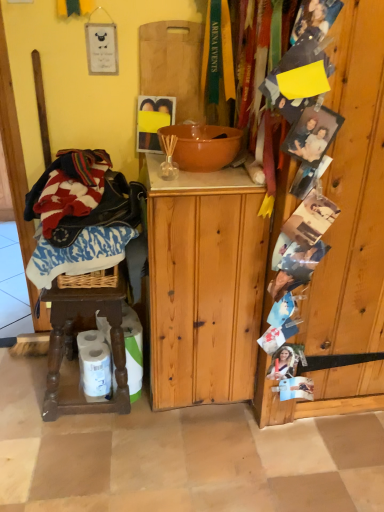
Measure the distance between brown wooden stool at lower left and camera.

The distance of brown wooden stool at lower left from camera is 1.32 meters.

Identify the location of white matte toilet paper at lower left, which is the first toilet paper in left-to-right order. The height and width of the screenshot is (512, 384). (95, 365).

Find the location of a particular element. The height and width of the screenshot is (512, 384). wooden cutting board at upper center is located at coordinates (172, 63).

Identify the location of orange ceramic bowl at center. (203, 146).

Does wooden photo display at right lie behind natural wood cabinet at center?

No, wooden photo display at right is closer to the viewer.

From a real-world perspective, is wooden photo display at right positioned over natural wood cabinet at center based on gravity?

Yes, from a real-world perspective, wooden photo display at right is above natural wood cabinet at center.

Is wooden photo display at right not near natural wood cabinet at center?

No, wooden photo display at right is not far away from natural wood cabinet at center.

Are natural wood cabinet at center and white matte toilet paper at lower left, which is the first toilet paper in left-to-right order, located far from each other?

They are positioned close to each other.

Does natural wood cabinet at center have a greater width compared to white matte toilet paper at lower left, positioned as the 2th toilet paper in right-to-left order?

Indeed, natural wood cabinet at center has a greater width compared to white matte toilet paper at lower left, positioned as the 2th toilet paper in right-to-left order.

Between point (172, 280) and point (102, 395), which one is positioned in front?

Point (172, 280)

Between natural wood cabinet at center and white matte toilet paper at lower left, positioned as the 2th toilet paper in right-to-left order, which one has smaller size?

With smaller size is white matte toilet paper at lower left, positioned as the 2th toilet paper in right-to-left order.

Is brown wooden stool at lower left aimed at natural wood cabinet at center?

No, brown wooden stool at lower left is not aimed at natural wood cabinet at center.

From the image's perspective, is brown wooden stool at lower left over natural wood cabinet at center?

No.

Looking at this image, which is closer to the camera, (60,301) or (258,234)?

Point (258,234)

From a real-world perspective, relative to natural wood cabinet at center, is brown wooden stool at lower left vertically above or below?

Clearly, from a real-world perspective, brown wooden stool at lower left is below natural wood cabinet at center.

Which of these two, orange ceramic bowl at center or wooden cutting board at upper center, stands shorter?

Standing shorter between the two is orange ceramic bowl at center.

Would you say orange ceramic bowl at center is a long distance from wooden cutting board at upper center?

No.

From a real-world perspective, is orange ceramic bowl at center below wooden cutting board at upper center?

Correct, in the physical world, orange ceramic bowl at center is lower than wooden cutting board at upper center.

Is orange ceramic bowl at center thinner than wooden cutting board at upper center?

No, orange ceramic bowl at center is not thinner than wooden cutting board at upper center.

Looking at this image, is natural wood cabinet at center thinner than wooden cutting board at upper center?

Incorrect, the width of natural wood cabinet at center is not less than that of wooden cutting board at upper center.

Image resolution: width=384 pixels, height=512 pixels. Identify the location of cabinetry on the right of the wooden cutting board at upper center. (204, 285).

Is natural wood cabinet at center positioned behind wooden cutting board at upper center?

No, the depth of natural wood cabinet at center is less than that of wooden cutting board at upper center.

How many degrees apart are the facing directions of natural wood cabinet at center and wooden cutting board at upper center?

4.28 degrees.

Considering the relative sizes of wooden cutting board at upper center and orange ceramic bowl at center in the image provided, is wooden cutting board at upper center bigger than orange ceramic bowl at center?

No, wooden cutting board at upper center is not bigger than orange ceramic bowl at center.

I want to click on cutting board behind the orange ceramic bowl at center, so click(x=172, y=63).

From the image's perspective, is wooden cutting board at upper center above or below orange ceramic bowl at center?

Clearly, from the image's perspective, wooden cutting board at upper center is above orange ceramic bowl at center.

This screenshot has height=512, width=384. In order to click on cabinetry located above the white matte toilet paper at lower left, which is the first toilet paper in left-to-right order (from a real-world perspective) in this screenshot , I will do `click(204, 285)`.

How many degrees apart are the facing directions of white matte toilet paper at lower left, positioned as the 2th toilet paper in right-to-left order, and natural wood cabinet at center?

The facing directions of white matte toilet paper at lower left, positioned as the 2th toilet paper in right-to-left order, and natural wood cabinet at center are 67.1 degrees apart.

Looking at their sizes, would you say white matte toilet paper at lower left, which is the first toilet paper in left-to-right order, is wider or thinner than natural wood cabinet at center?

In the image, white matte toilet paper at lower left, which is the first toilet paper in left-to-right order, appears to be more narrow than natural wood cabinet at center.

Locate an element on the screen. cabinetry that appears below the wooden photo display at right (from a real-world perspective) is located at coordinates (204, 285).

The height and width of the screenshot is (512, 384). Find the location of `cabinetry that appears above the white matte toilet paper at lower left, positioned as the 2th toilet paper in right-to-left order (from the image's perspective)`. cabinetry that appears above the white matte toilet paper at lower left, positioned as the 2th toilet paper in right-to-left order (from the image's perspective) is located at coordinates (204, 285).

Which object lies nearer to the anchor point natural wood cabinet at center, white matte toilet paper at lower left, which is the first toilet paper in left-to-right order, or wooden photo display at right?

wooden photo display at right lies closer to natural wood cabinet at center than the other object.

Looking at the image, which one is located further to wooden photo display at right, white matte toilet paper at lower left, positioned as the 2th toilet paper in right-to-left order, or white glossy toilet paper at lower left, arranged as the first toilet paper when viewed from the right?

Based on the image, white matte toilet paper at lower left, positioned as the 2th toilet paper in right-to-left order, appears to be further to wooden photo display at right.

From the image, which object appears to be nearer to white matte toilet paper at lower left, which is the first toilet paper in left-to-right order, white glossy toilet paper at lower left, arranged as the first toilet paper when viewed from the right, or wooden photo display at right?

white glossy toilet paper at lower left, arranged as the first toilet paper when viewed from the right, is positioned closer to the anchor white matte toilet paper at lower left, which is the first toilet paper in left-to-right order.

Estimate the real-world distances between objects in this image. Which object is further from white glossy toilet paper at lower left, which is the second toilet paper in left-to-right order, brown wooden stool at lower left or orange ceramic bowl at center?

orange ceramic bowl at center is further to white glossy toilet paper at lower left, which is the second toilet paper in left-to-right order.

In the scene shown: When comparing their distances from brown wooden stool at lower left, does wooden photo display at right or natural wood cabinet at center seem further?

wooden photo display at right.

Based on their spatial positions, is brown wooden stool at lower left or orange ceramic bowl at center closer to wooden cutting board at upper center?

orange ceramic bowl at center lies closer to wooden cutting board at upper center than the other object.

Consider the image. From the image, which object appears to be nearer to wooden cutting board at upper center, natural wood cabinet at center or orange ceramic bowl at center?

Among the two, orange ceramic bowl at center is located nearer to wooden cutting board at upper center.

Based on their spatial positions, is white glossy toilet paper at lower left, which is the second toilet paper in left-to-right order, or brown wooden stool at lower left closer to wooden cutting board at upper center?

brown wooden stool at lower left is closer to wooden cutting board at upper center.

This screenshot has width=384, height=512. What are the coordinates of `cabinetry between white matte toilet paper at lower left, which is the first toilet paper in left-to-right order, and wooden photo display at right from left to right` in the screenshot? It's located at (204, 285).

Where is `stool between wooden cutting board at upper center and white glossy toilet paper at lower left, arranged as the first toilet paper when viewed from the right, from top to bottom`? stool between wooden cutting board at upper center and white glossy toilet paper at lower left, arranged as the first toilet paper when viewed from the right, from top to bottom is located at coordinates tap(74, 345).

You are a GUI agent. You are given a task and a screenshot of the screen. Output one action in this format:
    pyautogui.click(x=<x>, y=<y>)
    Task: Click on the stool between orange ceramic bowl at center and white matte toilet paper at lower left, which is the first toilet paper in left-to-right order, in the vertical direction
    
    Given the screenshot: What is the action you would take?
    pyautogui.click(x=74, y=345)

Locate an element on the screen. Image resolution: width=384 pixels, height=512 pixels. toilet paper between wooden cutting board at upper center and white matte toilet paper at lower left, which is the first toilet paper in left-to-right order, in the vertical direction is located at coordinates (133, 350).